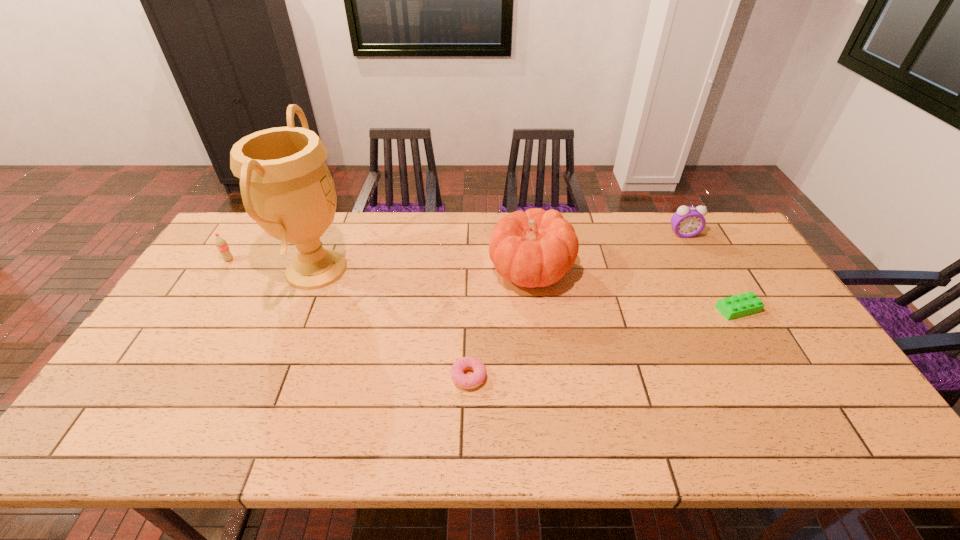
The width and height of the screenshot is (960, 540). In order to click on vacant area situated 0.350m on the left of the second tallest object in this screenshot , I will do `click(378, 270)`.

The width and height of the screenshot is (960, 540). I want to click on free space located 0.160m on the face of the alarm clock, so click(x=703, y=269).

In order to click on blank space located 0.130m on the back of the leftmost object in this screenshot , I will do `click(247, 233)`.

Identify the location of blank area located 0.310m on the front of the Lego. Image resolution: width=960 pixels, height=540 pixels. (803, 421).

I want to click on vacant space located on the back of the shortest object, so click(471, 264).

This screenshot has width=960, height=540. I want to click on trophy that is at the far edge, so click(x=286, y=187).

Where is `pumpkin that is positioned at the far edge`? The width and height of the screenshot is (960, 540). pumpkin that is positioned at the far edge is located at coordinates (536, 248).

Where is `alarm clock that is positioned at the far edge`? This screenshot has height=540, width=960. alarm clock that is positioned at the far edge is located at coordinates (687, 222).

This screenshot has height=540, width=960. What are the coordinates of `object that is at the left edge` in the screenshot? It's located at (221, 244).

Where is `alarm clock that is at the right edge`? This screenshot has width=960, height=540. alarm clock that is at the right edge is located at coordinates (687, 222).